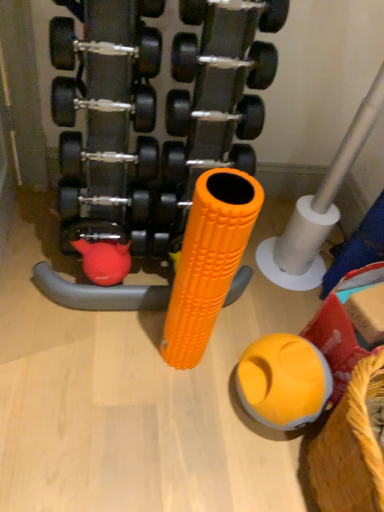
Identify the location of free space to the back side of rubberized yellow ball at lower right. The height and width of the screenshot is (512, 384). (254, 322).